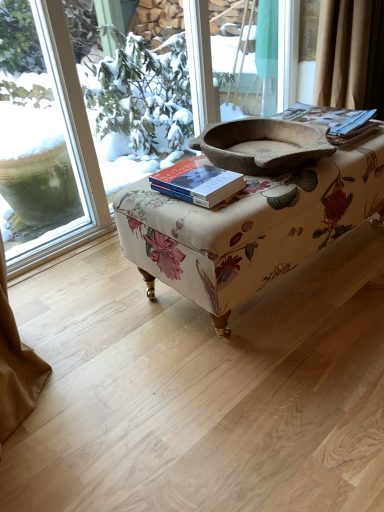
Locate an element on the screen. The height and width of the screenshot is (512, 384). unoccupied area in front of hardcover book at center, the first paperback book positioned from the front is located at coordinates (205, 214).